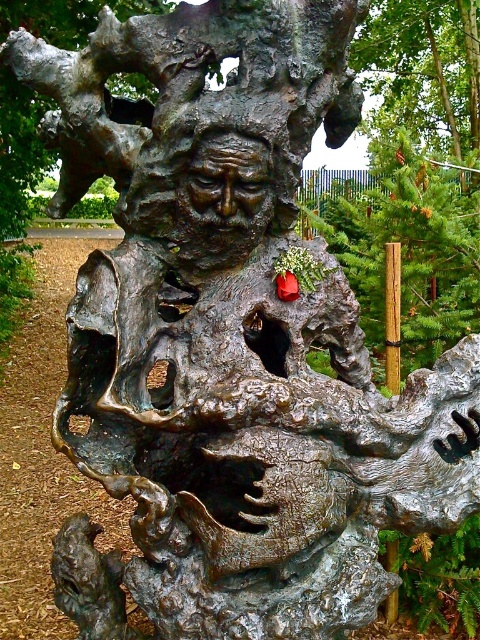
Can you confirm if green textured pine tree at upper center is thinner than bronze textured face at center?

A: Incorrect, green textured pine tree at upper center's width is not less than bronze textured face at center's.

Is point (396, 77) positioned behind point (208, 225)?

Yes.

Where is `green textured pine tree at upper center`? green textured pine tree at upper center is located at coordinates (423, 72).

At what (x,y) coordinates should I click in order to perform the action: click on green textured pine tree at upper center. Please return your answer as a coordinate pair (x, y). Looking at the image, I should click on (423, 72).